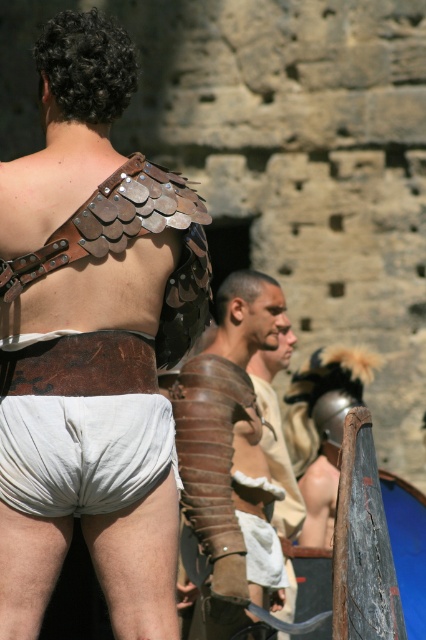
Question: Which point is farther to the camera?

Choices:
 (A) brown leather armor at center
 (B) white cotton shorts at lower center
 (C) leather/scaly armor at back

Answer: (A)

Question: Does leather/scaly armor at back have a lesser width compared to brown leather armor at center?

Choices:
 (A) yes
 (B) no

Answer: (B)

Question: Among these objects, which one is farthest from the camera?

Choices:
 (A) white cotton shorts at lower center
 (B) brown leather armor at center
 (C) leather/scaly armor at back

Answer: (B)

Question: Which of the following is the closest to the observer?

Choices:
 (A) white cotton shorts at lower center
 (B) leather/scaly armor at back
 (C) brown leather armor at center

Answer: (B)

Question: Does leather/scaly armor at back have a greater width compared to white cotton shorts at lower center?

Choices:
 (A) yes
 (B) no

Answer: (A)

Question: Where is leather/scaly armor at back located in relation to brown leather armor at center in the image?

Choices:
 (A) above
 (B) below

Answer: (A)